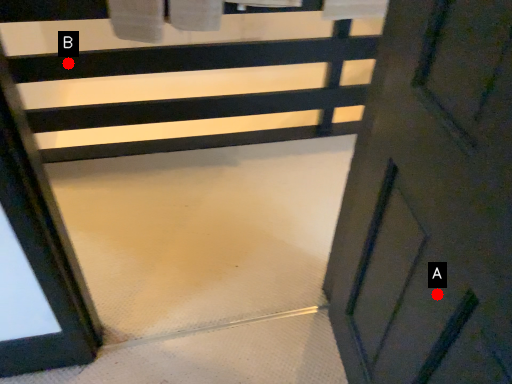
Question: Two points are circled on the image, labeled by A and B beside each circle. Among these points, which one is farthest from the camera?

Choices:
 (A) A is further
 (B) B is further

Answer: (B)